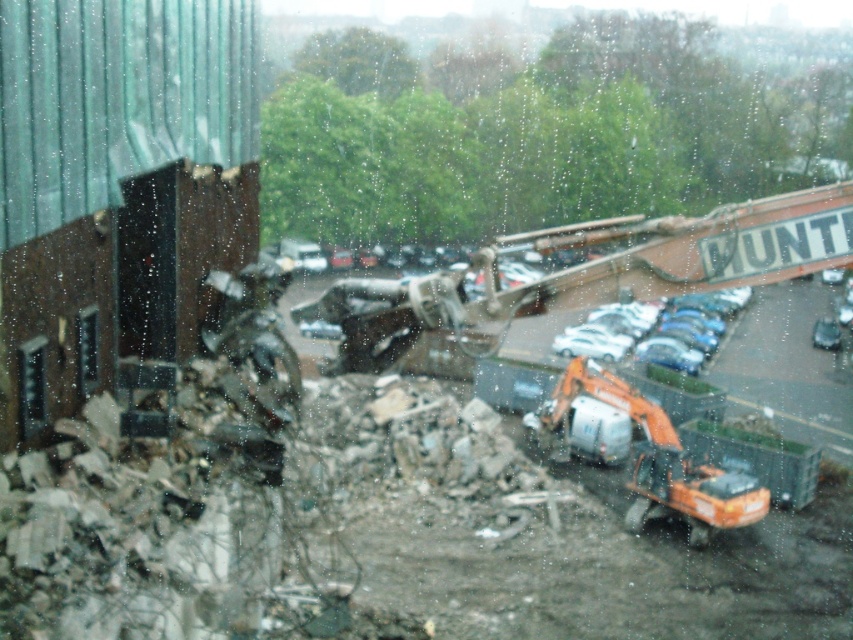
You are a construction worker trying to determine which excavator is wider. You see an orange metallic excavator at center and an orange metallic excavator at lower right through the window. Which one is wider?

The orange metallic excavator at center is wider than the orange metallic excavator at lower right according to the description.

Looking at this image, you are standing in a room looking through a window with water droplets. You see an orange metallic excavator at lower right and a shiny silver car at center. Which object is closer to the bottom edge of the window?

The orange metallic excavator at lower right is closer to the bottom edge of the window because it is located below the shiny silver car at center.